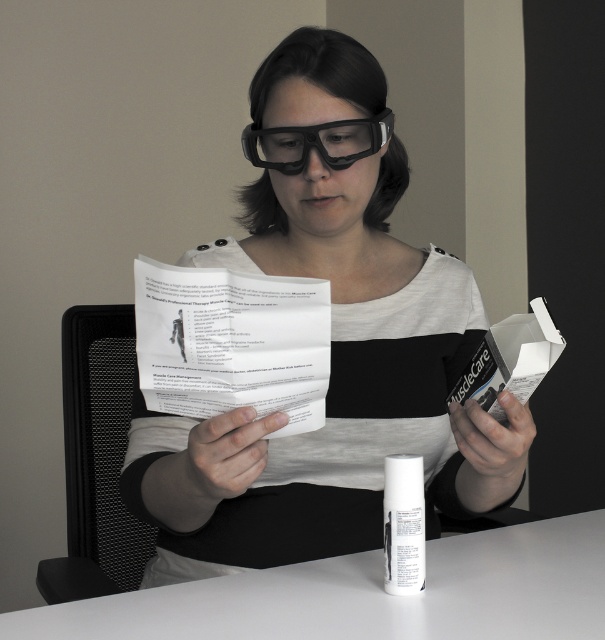
You are a photographer trying to capture a clear photo of the white matte table at center without the matte black glasses at upper center blocking it. Based on their positions, is this possible?

The matte black glasses at upper center are closer to the viewer than the white matte table at center, so they will block the view of the table. Therefore, it is not possible to capture a clear photo of the white matte table at center without the glasses blocking it.

Based on the photo, you are a customer service representative who needs to place a new order for office supplies. You see the white matte table at center and the transparent plastic glasses at center in the image. Which object is shorter in height?

The white matte table at center is not as tall as the transparent plastic glasses at center, so the white matte table at center is shorter in height.

You are a customer service representative trying to determine if the glasses are visible in the image. The glasses are located at point (330, 392). Based on the scene description, can you confirm if the glasses are visible?

The point (330, 392) indicates matte black glasses at upper center, so yes, the glasses are visible at that location.